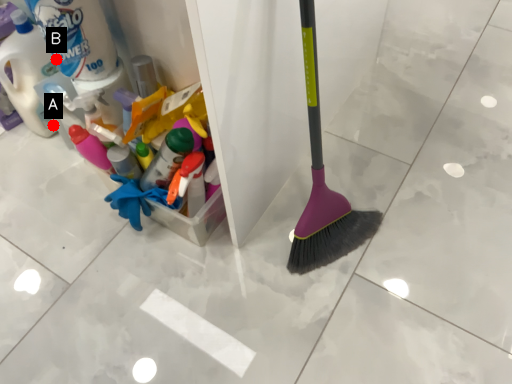
Question: Two points are circled on the image, labeled by A and B beside each circle. Among these points, which one is farthest from the camera?

Choices:
 (A) A is further
 (B) B is further

Answer: (A)